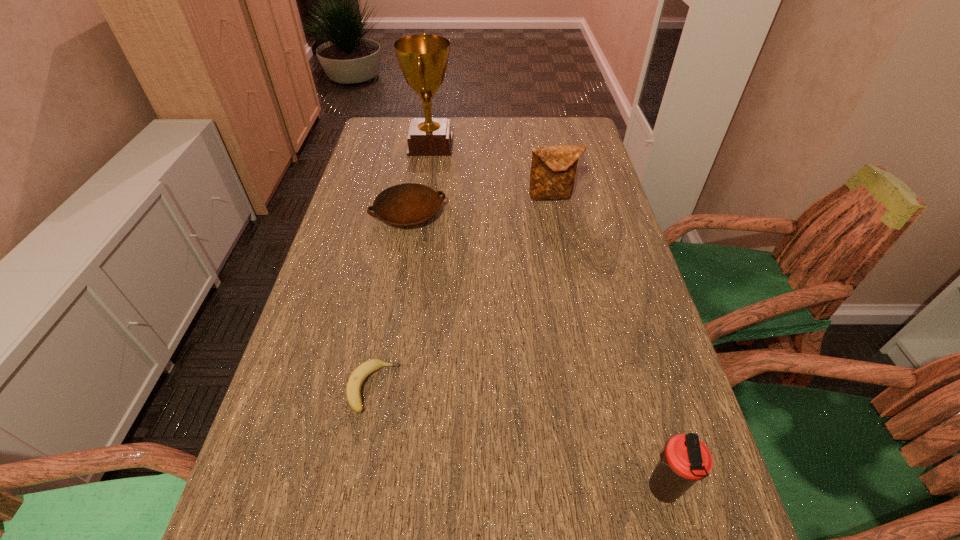
At what (x,y) coordinates should I click in order to perform the action: click on the tallest object. Please return your answer as a coordinate pair (x, y). Looking at the image, I should click on (423, 59).

Identify the location of award. (423, 59).

Locate an element on the screen. This screenshot has width=960, height=540. clutch bag is located at coordinates (553, 168).

Identify the location of thermos bottle. The width and height of the screenshot is (960, 540). (685, 460).

Where is `the second shortest object`? This screenshot has height=540, width=960. the second shortest object is located at coordinates (408, 204).

Locate an element on the screen. The height and width of the screenshot is (540, 960). banana is located at coordinates (354, 384).

This screenshot has height=540, width=960. I want to click on the shortest object, so click(x=354, y=384).

Find the location of a particular element. free space located on the plaque of the award is located at coordinates (475, 145).

Where is `vacant space located 0.160m on the open side of the clutch bag`? vacant space located 0.160m on the open side of the clutch bag is located at coordinates (561, 241).

The height and width of the screenshot is (540, 960). In order to click on free space located 0.230m on the left of the nearest object in this screenshot , I will do `click(502, 489)`.